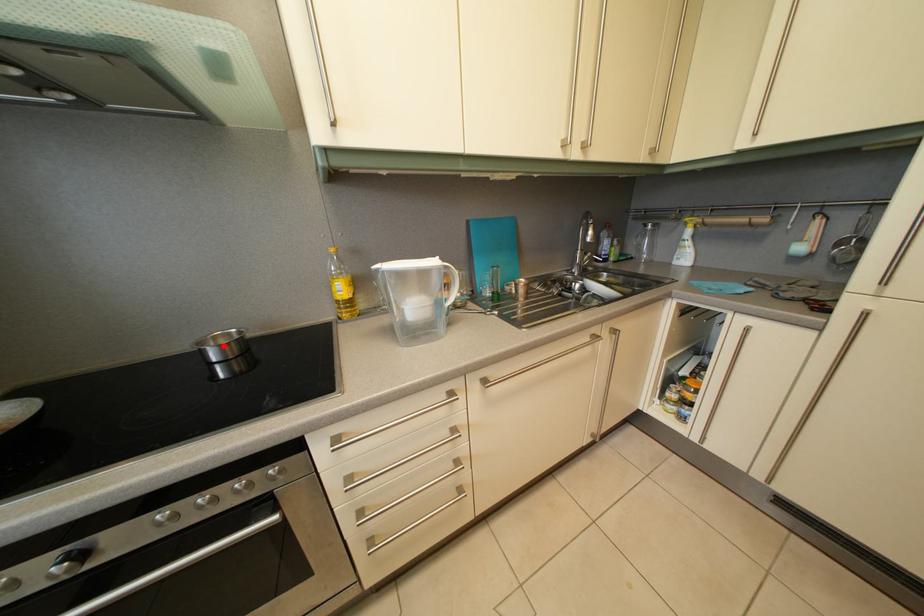
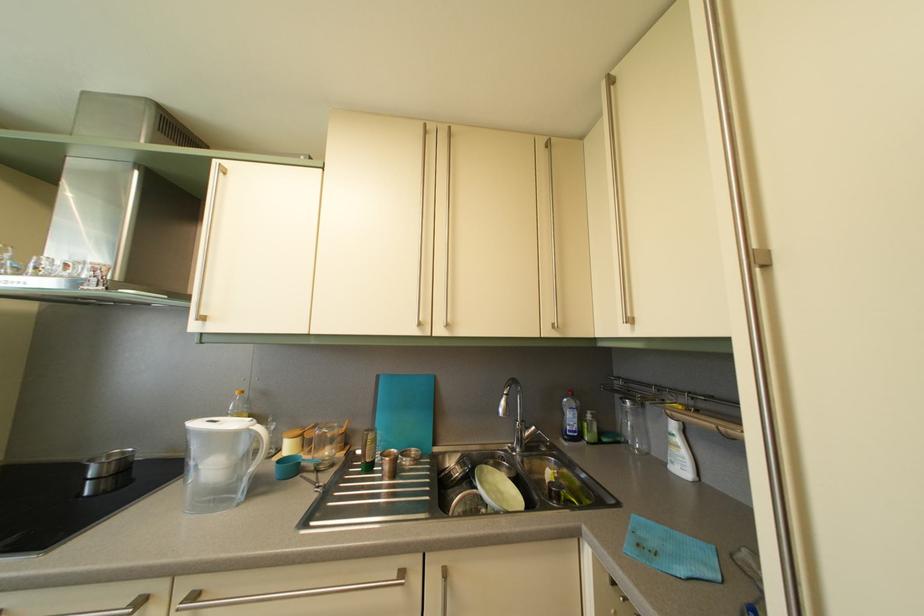
In the second image, find the point that corresponds to the highlighted location in the first image.

(118, 463)